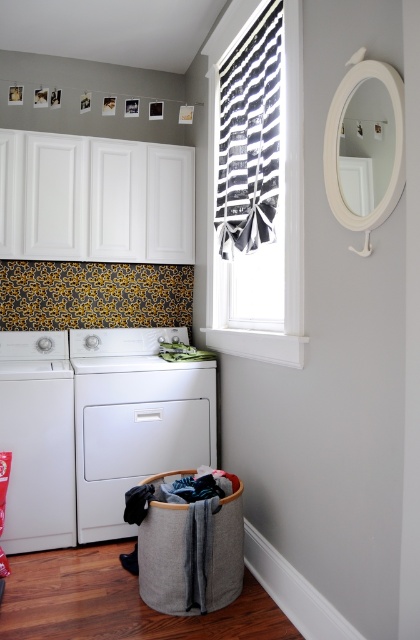
Is white matte washing machine at lower left further to camera compared to white matte washing machine at left?

Yes.

Does white matte washing machine at lower left have a greater width compared to white matte washing machine at left?

Correct, the width of white matte washing machine at lower left exceeds that of white matte washing machine at left.

Where is `white matte washing machine at lower left`? white matte washing machine at lower left is located at coordinates (133, 419).

Does white matte washing machine at lower left appear under gray fabric laundry basket at lower right?

No, white matte washing machine at lower left is not below gray fabric laundry basket at lower right.

Can you confirm if white matte washing machine at lower left is positioned to the left of gray fabric laundry basket at lower right?

Correct, you'll find white matte washing machine at lower left to the left of gray fabric laundry basket at lower right.

The height and width of the screenshot is (640, 420). What are the coordinates of `white matte washing machine at lower left` in the screenshot? It's located at (133, 419).

Can you confirm if black/white striped fabric at center is positioned above gray fabric laundry basket at lower right?

Yes.

Who is lower down, black/white striped fabric at center or gray fabric laundry basket at lower right?

gray fabric laundry basket at lower right

Image resolution: width=420 pixels, height=640 pixels. Find the location of `black/white striped fabric at center`. black/white striped fabric at center is located at coordinates (257, 186).